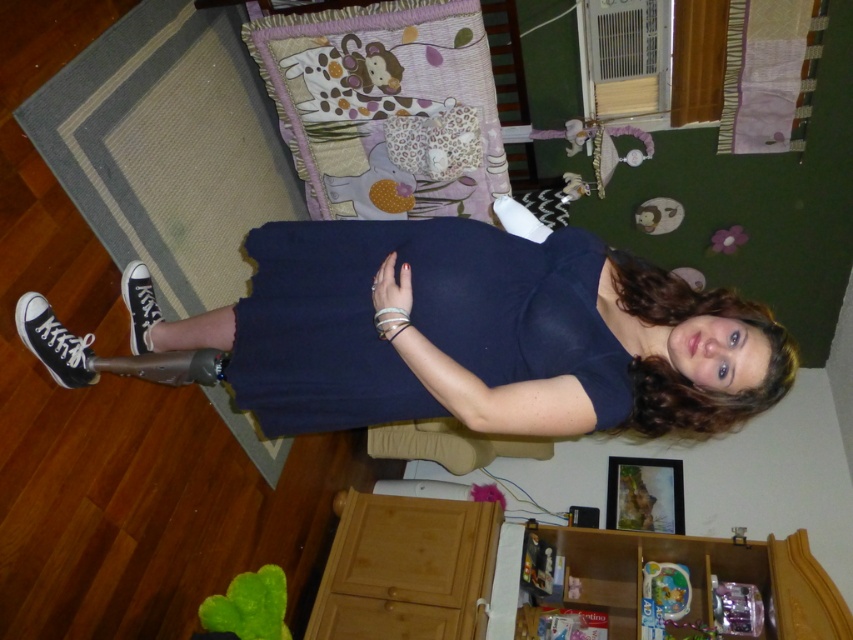
You are a parent trying to place a new toy on the pastel patchwork pillow at upper center. Considering the space it takes, will the toy fit if the wooden cabinet at lower center is moved closer to it?

The pastel patchwork pillow at upper center occupies less space than the wooden cabinet at lower center. Moving the cabinet closer may reduce the available space for placing the toy, so it might not fit if the cabinet is too close.

You are a parent trying to place a toy on the wooden cabinet at lower center and the wooden drawer at lower center. Which one has a wider surface to place the toy?

The wooden cabinet at lower center has a wider surface than the wooden drawer at lower center because the wooden cabinet at lower center is wider.